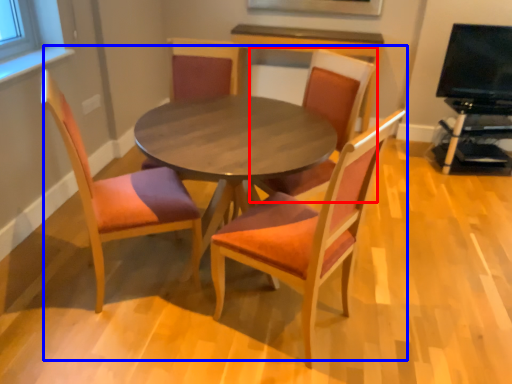
Question: Among these objects, which one is nearest to the camera, chair (highlighted by a red box) or kitchen & dining room table (highlighted by a blue box)?

Choices:
 (A) chair
 (B) kitchen & dining room table

Answer: (B)